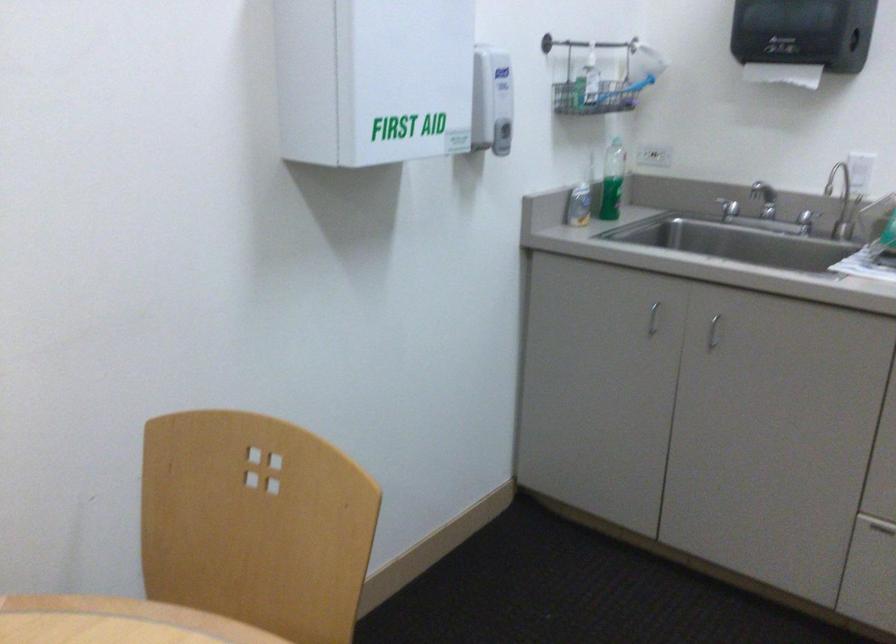
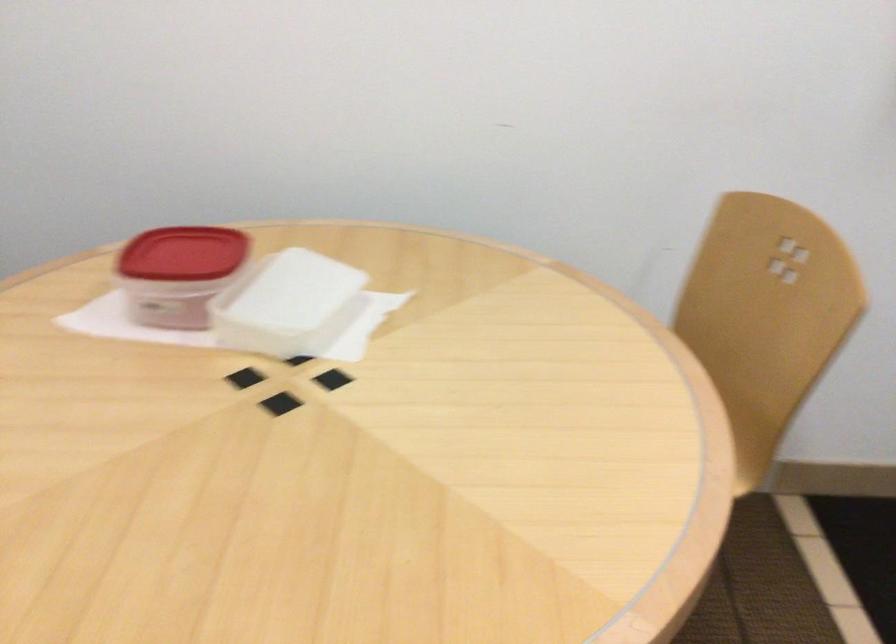
The images are taken continuously from a first-person perspective. In which direction is your viewpoint rotating?

The rotation direction of the camera is left-down.